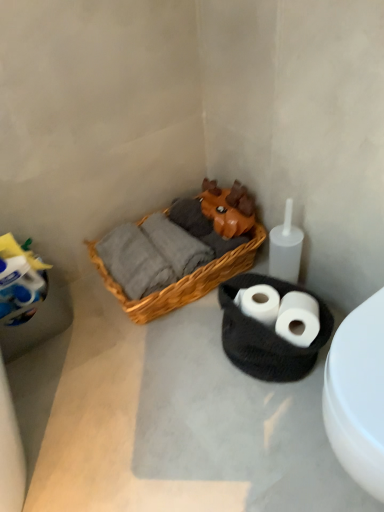
Where is `white matte toilet paper at lower right, the 2th toilet paper in the left-to-right sequence`? This screenshot has height=512, width=384. white matte toilet paper at lower right, the 2th toilet paper in the left-to-right sequence is located at coordinates (298, 318).

Find the location of a particular element. This screenshot has width=384, height=512. white matte toilet paper at center, the second toilet paper positioned from the right is located at coordinates (261, 304).

Find the location of `white matte toilet at lower right`. white matte toilet at lower right is located at coordinates (358, 394).

From a real-world perspective, is white matte toilet paper at center, the 1th toilet paper from the left, physically located above or below white matte toilet paper at lower right, the 2th toilet paper in the left-to-right sequence?

white matte toilet paper at center, the 1th toilet paper from the left, is situated lower than white matte toilet paper at lower right, the 2th toilet paper in the left-to-right sequence, in the real world.

How much distance is there between white matte toilet paper at center, the 1th toilet paper from the left, and white matte toilet paper at lower right, which is counted as the 1th toilet paper, starting from the right?

6.07 centimeters.

Does white matte toilet paper at center, the second toilet paper positioned from the right, have a lesser height compared to white matte toilet paper at lower right, which is counted as the 1th toilet paper, starting from the right?

Indeed, white matte toilet paper at center, the second toilet paper positioned from the right, has a lesser height compared to white matte toilet paper at lower right, which is counted as the 1th toilet paper, starting from the right.

Between white matte toilet paper at center, the second toilet paper positioned from the right, and white matte toilet paper at lower right, the 2th toilet paper in the left-to-right sequence, which one has larger width?

white matte toilet paper at lower right, the 2th toilet paper in the left-to-right sequence.

In terms of size, does white matte toilet paper at lower right, the 2th toilet paper in the left-to-right sequence, appear bigger or smaller than woven wood picnic basket at center?

Clearly, white matte toilet paper at lower right, the 2th toilet paper in the left-to-right sequence, is smaller in size than woven wood picnic basket at center.

How far apart are white matte toilet paper at lower right, the 2th toilet paper in the left-to-right sequence, and woven wood picnic basket at center?

40.01 centimeters.

Which object is wider, white matte toilet paper at lower right, the 2th toilet paper in the left-to-right sequence, or woven wood picnic basket at center?

woven wood picnic basket at center.

Is woven wood picnic basket at center inside white matte toilet paper at lower right, which is counted as the 1th toilet paper, starting from the right?

No, woven wood picnic basket at center is not a part of white matte toilet paper at lower right, which is counted as the 1th toilet paper, starting from the right.

Which of these two, woven basket at center or white matte toilet paper at center, the second toilet paper positioned from the right, stands taller?

Standing taller between the two is white matte toilet paper at center, the second toilet paper positioned from the right.

Is woven basket at center next to white matte toilet paper at center, the second toilet paper positioned from the right, and touching it?

No, woven basket at center is not next to white matte toilet paper at center, the second toilet paper positioned from the right.

How many degrees apart are the facing directions of white matte toilet paper at lower right, which is counted as the 1th toilet paper, starting from the right, and woven basket at center?

131 degrees separate the facing orientations of white matte toilet paper at lower right, which is counted as the 1th toilet paper, starting from the right, and woven basket at center.

Locate an element on the screen. The image size is (384, 512). concrete on the left side of white matte toilet paper at lower right, which is counted as the 1th toilet paper, starting from the right is located at coordinates (180, 422).

From a real-world perspective, is white matte toilet paper at lower right, which is counted as the 1th toilet paper, starting from the right, positioned above or below woven basket at center?

white matte toilet paper at lower right, which is counted as the 1th toilet paper, starting from the right, is situated higher than woven basket at center in the real world.

Is point (308, 316) closer or farther from the camera than point (342, 468)?

Point (308, 316) is farther from the camera than point (342, 468).

From a real-world perspective, who is located higher, white matte toilet at lower right or white matte toilet paper at lower right, which is counted as the 1th toilet paper, starting from the right?

white matte toilet at lower right.

Between white matte toilet at lower right and white matte toilet paper at lower right, the 2th toilet paper in the left-to-right sequence, which one has more height?

white matte toilet at lower right.

Does white matte toilet at lower right turn towards white matte toilet paper at lower right, which is counted as the 1th toilet paper, starting from the right?

No, white matte toilet at lower right does not turn towards white matte toilet paper at lower right, which is counted as the 1th toilet paper, starting from the right.

How different are the orientations of white matte toilet at lower right and white matte toilet paper at lower right, the 2th toilet paper in the left-to-right sequence, in degrees?

The angle between the facing direction of white matte toilet at lower right and the facing direction of white matte toilet paper at lower right, the 2th toilet paper in the left-to-right sequence, is 40.8 degrees.

Considering the positions of objects woven wood picnic basket at center and white matte toilet at lower right in the image provided, who is in front, woven wood picnic basket at center or white matte toilet at lower right?

white matte toilet at lower right is in front.

Is woven wood picnic basket at center completely or partially outside of white matte toilet at lower right?

Yes, woven wood picnic basket at center is outside of white matte toilet at lower right.

Which object is positioned more to the left, woven wood picnic basket at center or white matte toilet at lower right?

woven wood picnic basket at center is more to the left.

Looking at this image, considering the relative sizes of woven wood picnic basket at center and white matte toilet at lower right in the image provided, is woven wood picnic basket at center shorter than white matte toilet at lower right?

Yes, woven wood picnic basket at center is shorter than white matte toilet at lower right.

Is white matte toilet paper at lower right, the 2th toilet paper in the left-to-right sequence, far away from white matte toilet at lower right?

white matte toilet paper at lower right, the 2th toilet paper in the left-to-right sequence, is near white matte toilet at lower right, not far away.

From a real-world perspective, is white matte toilet paper at lower right, the 2th toilet paper in the left-to-right sequence, physically below white matte toilet at lower right?

Yes.

Which object is further away from the camera taking this photo, white matte toilet paper at lower right, the 2th toilet paper in the left-to-right sequence, or white matte toilet at lower right?

white matte toilet paper at lower right, the 2th toilet paper in the left-to-right sequence, is further away from the camera.

Locate an element on the screen. toilet paper in front of the white matte toilet paper at center, the 1th toilet paper from the left is located at coordinates (298, 318).

Which toilet paper is the 2nd one when counting from the right side of the woven wood picnic basket at center? Please provide its 2D coordinates.

[(298, 318)]

Which object lies further to the anchor point white matte toilet paper at lower right, which is counted as the 1th toilet paper, starting from the right, woven basket at center or woven wood picnic basket at center?

woven wood picnic basket at center is positioned further to the anchor white matte toilet paper at lower right, which is counted as the 1th toilet paper, starting from the right.

Based on their spatial positions, is white matte toilet paper at lower right, the 2th toilet paper in the left-to-right sequence, or woven basket at center further from white matte toilet paper at center, the 1th toilet paper from the left?

woven basket at center.

From the image, which object appears to be nearer to woven basket at center, white matte toilet at lower right or white matte toilet paper at center, the 1th toilet paper from the left?

white matte toilet paper at center, the 1th toilet paper from the left, lies closer to woven basket at center than the other object.

From the picture: Looking at the image, which one is located closer to white matte toilet paper at center, the second toilet paper positioned from the right, woven basket at center or white matte toilet at lower right?

woven basket at center is positioned closer to the anchor white matte toilet paper at center, the second toilet paper positioned from the right.

In the scene shown: From the image, which object appears to be farther from white matte toilet paper at lower right, which is counted as the 1th toilet paper, starting from the right, woven basket at center or white matte toilet paper at center, the second toilet paper positioned from the right?

woven basket at center.

When comparing their distances from woven basket at center, does white matte toilet paper at center, the second toilet paper positioned from the right, or white matte toilet paper at lower right, the 2th toilet paper in the left-to-right sequence, seem closer?

The object closer to woven basket at center is white matte toilet paper at center, the second toilet paper positioned from the right.

Which object lies further to the anchor point woven basket at center, white matte toilet at lower right or white matte toilet paper at lower right, which is counted as the 1th toilet paper, starting from the right?

white matte toilet at lower right is further to woven basket at center.

Which object lies nearer to the anchor point woven wood picnic basket at center, woven basket at center or white matte toilet paper at lower right, the 2th toilet paper in the left-to-right sequence?

woven basket at center is closer to woven wood picnic basket at center.

I want to click on concrete between white matte toilet at lower right and white matte toilet paper at lower right, which is counted as the 1th toilet paper, starting from the right, along the z-axis, so click(180, 422).

Locate an element on the screen. The height and width of the screenshot is (512, 384). concrete between white matte toilet at lower right and woven wood picnic basket at center in the front-back direction is located at coordinates (180, 422).

Find the location of a particular element. The image size is (384, 512). toilet paper located between woven wood picnic basket at center and white matte toilet paper at lower right, which is counted as the 1th toilet paper, starting from the right, in the left-right direction is located at coordinates (261, 304).

This screenshot has width=384, height=512. Find the location of `concrete between white matte toilet at lower right and white matte toilet paper at center, the second toilet paper positioned from the right, from front to back`. concrete between white matte toilet at lower right and white matte toilet paper at center, the second toilet paper positioned from the right, from front to back is located at coordinates (180, 422).